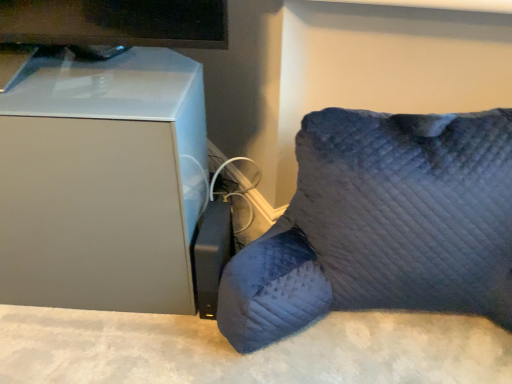
Question: In terms of width, does dark blue quilted pillow at lower right, arranged as the 2th furniture when viewed from the left, look wider or thinner when compared to white matte mini fridge at left, the 2th furniture when ordered from right to left?

Choices:
 (A) thin
 (B) wide

Answer: (B)

Question: From a real-world perspective, is dark blue quilted pillow at lower right, which is the 1th furniture in right-to-left order, physically located above or below white matte mini fridge at left, the 2th furniture when ordered from right to left?

Choices:
 (A) above
 (B) below

Answer: (B)

Question: From the image's perspective, is dark blue quilted pillow at lower right, arranged as the 2th furniture when viewed from the left, above or below white matte mini fridge at left, the 2th furniture when ordered from right to left?

Choices:
 (A) above
 (B) below

Answer: (B)

Question: Considering their positions, is white matte mini fridge at left, the 2th furniture when ordered from right to left, located in front of or behind dark blue quilted pillow at lower right, arranged as the 2th furniture when viewed from the left?

Choices:
 (A) front
 (B) behind

Answer: (B)

Question: Considering the positions of white matte mini fridge at left, acting as the 1th furniture starting from the left, and dark blue quilted pillow at lower right, which is the 1th furniture in right-to-left order, in the image, is white matte mini fridge at left, acting as the 1th furniture starting from the left, bigger or smaller than dark blue quilted pillow at lower right, which is the 1th furniture in right-to-left order,?

Choices:
 (A) small
 (B) big

Answer: (A)

Question: Does point (99, 276) appear closer or farther from the camera than point (468, 190)?

Choices:
 (A) farther
 (B) closer

Answer: (A)

Question: Is white matte mini fridge at left, acting as the 1th furniture starting from the left, wider or thinner than dark blue quilted pillow at lower right, which is the 1th furniture in right-to-left order?

Choices:
 (A) thin
 (B) wide

Answer: (A)